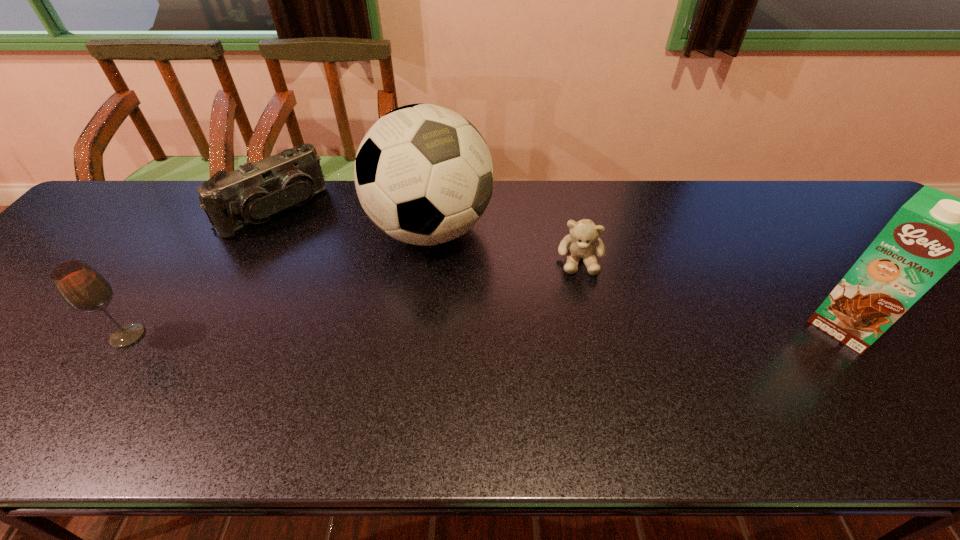
Find the location of a particular element. This screenshot has width=960, height=540. free space on the desktop that is between the glass drink container and the rightmost object and is positioned on the main logo of the third object from right to left is located at coordinates (516, 330).

Identify the location of vacant spot on the desktop that is between the third tallest object and the rightmost object and is positioned on the front-facing side of the camcorder. (398, 332).

In order to click on free space on the desktop that is between the third shortest object and the rightmost object and is positioned on the face of the shortest object in this screenshot , I will do `click(581, 329)`.